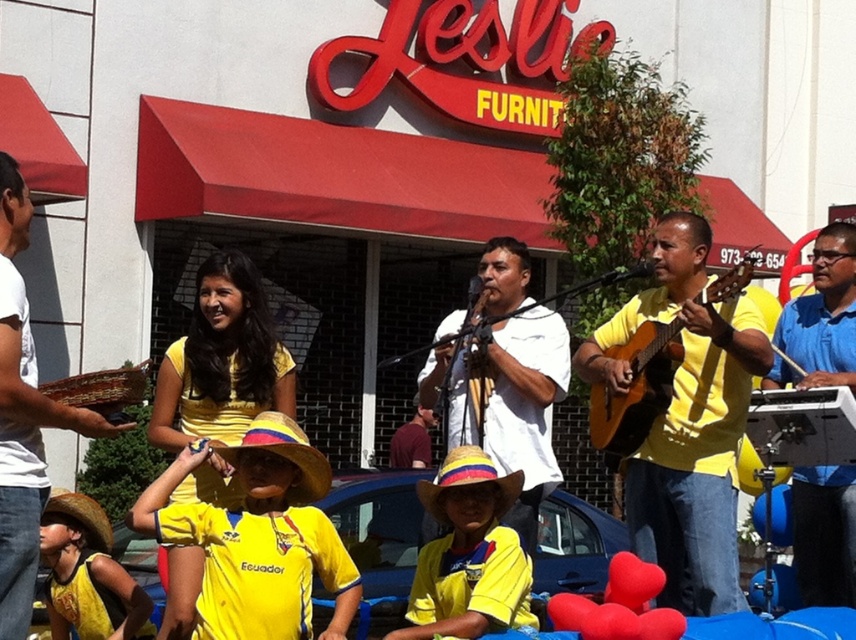
Question: Can you confirm if blue shirt at center is positioned above yellow matte guitar at center?

Choices:
 (A) yes
 (B) no

Answer: (B)

Question: Which object is farther from the camera taking this photo?

Choices:
 (A) yellow cotton shirt at lower center
 (B) white matte guitar at center
 (C) blue shirt at center
 (D) yellow fabric shirt at lower left

Answer: (C)

Question: Where is matte yellow shirt at center located in relation to yellow cotton shirt at lower center in the image?

Choices:
 (A) above
 (B) below

Answer: (A)

Question: Which of these objects is positioned closest to the white woven basket at left?

Choices:
 (A) blue shirt at center
 (B) yellow cotton shirt at lower center
 (C) matte yellow shirt at center

Answer: (B)

Question: Which point is closer to the camera?

Choices:
 (A) (788, 369)
 (B) (103, 529)
 (C) (601, 392)

Answer: (B)

Question: In this image, where is matte yellow shirt at center located relative to yellow cotton shirt at lower center?

Choices:
 (A) below
 (B) above

Answer: (B)